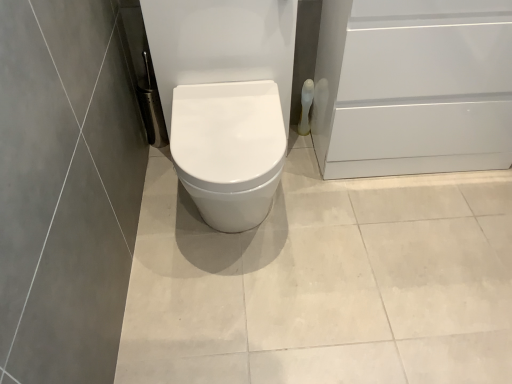
Question: Is white glossy screen door at right turned away from white glossy toilet paper at right?

Choices:
 (A) yes
 (B) no

Answer: (B)

Question: Is white glossy screen door at right bigger than white glossy toilet paper at right?

Choices:
 (A) no
 (B) yes

Answer: (B)

Question: Is white glossy screen door at right smaller than white glossy toilet paper at right?

Choices:
 (A) no
 (B) yes

Answer: (A)

Question: Does white glossy screen door at right have a lesser height compared to white glossy toilet paper at right?

Choices:
 (A) yes
 (B) no

Answer: (B)

Question: Is white glossy toilet paper at right surrounded by white glossy screen door at right?

Choices:
 (A) yes
 (B) no

Answer: (B)

Question: Is white glossy screen door at right oriented towards white glossy toilet paper at right?

Choices:
 (A) no
 (B) yes

Answer: (A)

Question: From a real-world perspective, does white glossy toilet paper at right sit lower than white glossy screen door at right?

Choices:
 (A) yes
 (B) no

Answer: (A)

Question: Could you tell me if white glossy toilet paper at right is facing white glossy screen door at right?

Choices:
 (A) no
 (B) yes

Answer: (A)

Question: Considering the relative sizes of white glossy toilet paper at right and white glossy screen door at right in the image provided, is white glossy toilet paper at right smaller than white glossy screen door at right?

Choices:
 (A) no
 (B) yes

Answer: (B)

Question: Considering the relative sizes of white glossy toilet paper at right and white glossy screen door at right in the image provided, is white glossy toilet paper at right taller than white glossy screen door at right?

Choices:
 (A) no
 (B) yes

Answer: (A)

Question: Is white glossy toilet paper at right to the right of white glossy screen door at right from the viewer's perspective?

Choices:
 (A) no
 (B) yes

Answer: (A)

Question: Considering the relative sizes of white glossy toilet paper at right and white glossy screen door at right in the image provided, is white glossy toilet paper at right bigger than white glossy screen door at right?

Choices:
 (A) yes
 (B) no

Answer: (B)

Question: From a real-world perspective, relative to white glossy toilet paper at right, is white glossy screen door at right vertically above or below?

Choices:
 (A) below
 (B) above

Answer: (B)